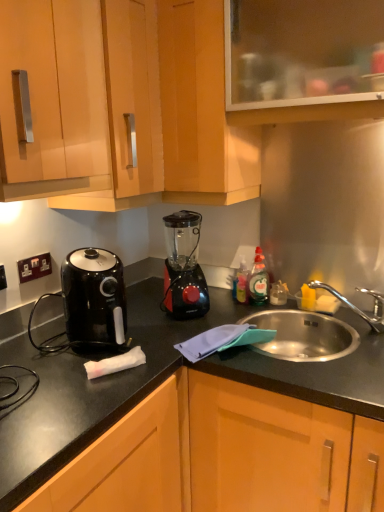
Consider the image. How much space does black plastic electric outlet at lower left, which ranks as the 1th electric outlet in left-to-right order, occupy horizontally?

black plastic electric outlet at lower left, which ranks as the 1th electric outlet in left-to-right order, is 0.73 inches wide.

Based on the photo, in order to face black glossy air fryer at left, should I rotate leftwards or rightwards?

Turn left approximately 11.627 degrees to face it.

Find the location of a particular element. This screenshot has height=512, width=384. black plastic electrical outlet at left, which ranks as the 2th electric outlet in front-to-back order is located at coordinates (34, 267).

What do you see at coordinates (74, 100) in the screenshot?
I see `matte wood cabinet at upper left, which is the second cabinetry from bottom to top` at bounding box center [74, 100].

This screenshot has width=384, height=512. What do you see at coordinates (201, 110) in the screenshot?
I see `wooden cabinet at upper center, which is the 4th cabinetry from bottom to top` at bounding box center [201, 110].

What are the coordinates of `black plastic electric outlet at lower left, positioned as the first electric outlet in front-to-back order` in the screenshot? It's located at (2, 278).

Can you tell me how much black plastic electrical outlet at left, the second electric outlet positioned from the left, and matte wood cabinets at upper center, the third cabinetry from the top, differ in facing direction?

90.1 degrees.

Does black plastic electrical outlet at left, the second electric outlet positioned from the left, turn towards matte wood cabinets at upper center, the third cabinetry from the top?

No, black plastic electrical outlet at left, the second electric outlet positioned from the left, does not turn towards matte wood cabinets at upper center, the third cabinetry from the top.

What are the coordinates of `the 5th cabinetry in front of the black plastic electrical outlet at left, arranged as the first electric outlet when viewed from the back` in the screenshot? It's located at click(137, 108).

Which is closer, (153, 26) or (34, 263)?

Clearly, point (153, 26) is closer to the camera than point (34, 263).

Is matte wood cabinet at upper left, the fourth cabinetry when ordered from top to bottom, positioned far away from black plastic electrical outlet at left, the first electric outlet viewed from the right?

No, matte wood cabinet at upper left, the fourth cabinetry when ordered from top to bottom, is not far from black plastic electrical outlet at left, the first electric outlet viewed from the right.

Is matte wood cabinet at upper left, the fourth cabinetry when ordered from top to bottom, wider than black plastic electrical outlet at left, which ranks as the 2th electric outlet in front-to-back order?

Yes.

Between black plastic electric outlet at lower left, which is counted as the second electric outlet, starting from the back, and black plastic blender at center, which one has smaller width?

With smaller width is black plastic electric outlet at lower left, which is counted as the second electric outlet, starting from the back.

From the image's perspective, is black plastic electric outlet at lower left, which is counted as the second electric outlet, starting from the back, above or below black plastic blender at center?

Based on their image positions, black plastic electric outlet at lower left, which is counted as the second electric outlet, starting from the back, is located beneath black plastic blender at center.

Between point (1, 280) and point (173, 231), which one is positioned behind?

The point (173, 231) is farther from the camera.

From a real-world perspective, is wooden cabinet at upper center, arranged as the second cabinetry when viewed from the top, located beneath black plastic electrical outlet at left, the second electric outlet positioned from the left?

No.

How many degrees apart are the facing directions of wooden cabinet at upper center, which is the 4th cabinetry from bottom to top, and black plastic electrical outlet at left, the second electric outlet positioned from the left?

The facing directions of wooden cabinet at upper center, which is the 4th cabinetry from bottom to top, and black plastic electrical outlet at left, the second electric outlet positioned from the left, are 90.1 degrees apart.

From the image's perspective, which is above, wooden cabinet at upper center, arranged as the second cabinetry when viewed from the top, or black plastic electrical outlet at left, the second electric outlet positioned from the left?

wooden cabinet at upper center, arranged as the second cabinetry when viewed from the top.

Considering the positions of points (192, 117) and (33, 259), is point (192, 117) closer to camera compared to point (33, 259)?

Yes, it is.

Can you tell me how much transparent glass cabinet at upper center, placed as the 1th cabinetry when sorted from top to bottom, and wooden cabinet at upper center, arranged as the second cabinetry when viewed from the top, differ in facing direction?

0.488 degrees.

Can you confirm if transparent glass cabinet at upper center, marked as the fifth cabinetry in a bottom-to-top arrangement, is thinner than wooden cabinet at upper center, which is the 4th cabinetry from bottom to top?

No.

Is transparent glass cabinet at upper center, placed as the 1th cabinetry when sorted from top to bottom, touching wooden cabinet at upper center, which is the 4th cabinetry from bottom to top?

No, transparent glass cabinet at upper center, placed as the 1th cabinetry when sorted from top to bottom, is not touching wooden cabinet at upper center, which is the 4th cabinetry from bottom to top.

In the scene shown: In terms of height, does transparent glass cabinet at upper center, placed as the 1th cabinetry when sorted from top to bottom, look taller or shorter compared to wooden cabinet at upper center, which is the 4th cabinetry from bottom to top?

transparent glass cabinet at upper center, placed as the 1th cabinetry when sorted from top to bottom, is shorter than wooden cabinet at upper center, which is the 4th cabinetry from bottom to top.

Is wooden cabinet at upper center, arranged as the second cabinetry when viewed from the top, closer to the viewer compared to transparent glass cabinet at upper center, placed as the 1th cabinetry when sorted from top to bottom?

No, wooden cabinet at upper center, arranged as the second cabinetry when viewed from the top, is further to the viewer.

Is wooden cabinet at upper center, which is the 4th cabinetry from bottom to top, located outside transparent glass cabinet at upper center, placed as the 1th cabinetry when sorted from top to bottom?

Yes, wooden cabinet at upper center, which is the 4th cabinetry from bottom to top, is outside of transparent glass cabinet at upper center, placed as the 1th cabinetry when sorted from top to bottom.

Looking at the image, does wooden cabinet at upper center, arranged as the second cabinetry when viewed from the top, seem bigger or smaller compared to transparent glass cabinet at upper center, marked as the fifth cabinetry in a bottom-to-top arrangement?

In the image, wooden cabinet at upper center, arranged as the second cabinetry when viewed from the top, appears to be larger than transparent glass cabinet at upper center, marked as the fifth cabinetry in a bottom-to-top arrangement.

From a real-world perspective, which object rests below the other?

wooden cabinet at upper center, arranged as the second cabinetry when viewed from the top, from a real-world perspective.

Does matte wood cabinets at upper center, the third cabinetry from the top, touch transparent glass cabinet at upper center, placed as the 1th cabinetry when sorted from top to bottom?

No, matte wood cabinets at upper center, the third cabinetry from the top, is not beside transparent glass cabinet at upper center, placed as the 1th cabinetry when sorted from top to bottom.

Is matte wood cabinets at upper center, which appears as the 3th cabinetry when ordered from the bottom, facing away from transparent glass cabinet at upper center, marked as the fifth cabinetry in a bottom-to-top arrangement?

matte wood cabinets at upper center, which appears as the 3th cabinetry when ordered from the bottom, does not have its back to transparent glass cabinet at upper center, marked as the fifth cabinetry in a bottom-to-top arrangement.

Does matte wood cabinets at upper center, which appears as the 3th cabinetry when ordered from the bottom, have a lesser width compared to transparent glass cabinet at upper center, placed as the 1th cabinetry when sorted from top to bottom?

No.

This screenshot has height=512, width=384. There is a transparent glass cabinet at upper center, placed as the 1th cabinetry when sorted from top to bottom. In order to click on the 2nd cabinetry below it (from a real-world perspective) in this screenshot , I will do `click(137, 108)`.

Identify the location of the 2nd cabinetry positioned above the black plastic electrical outlet at left, arranged as the first electric outlet when viewed from the back (from a real-world perspective). (137, 108).

Where is `the 2nd cabinetry in front when counting from the black plastic electrical outlet at left, which ranks as the 2th electric outlet in front-to-back order`? the 2nd cabinetry in front when counting from the black plastic electrical outlet at left, which ranks as the 2th electric outlet in front-to-back order is located at coordinates (74, 100).

Which object lies further to the anchor point black plastic electric outlet at lower left, positioned as the first electric outlet in front-to-back order, transparent glass cabinet at upper center, placed as the 1th cabinetry when sorted from top to bottom, or matte wood cabinets at upper center, which appears as the 3th cabinetry when ordered from the bottom?

transparent glass cabinet at upper center, placed as the 1th cabinetry when sorted from top to bottom, is further to black plastic electric outlet at lower left, positioned as the first electric outlet in front-to-back order.

Looking at the image, which one is located further to black glossy air fryer at left, black plastic electric outlet at lower left, which ranks as the 1th electric outlet in left-to-right order, or wooden cabinet at lower center, which appears as the 5th cabinetry when viewed from the top?

wooden cabinet at lower center, which appears as the 5th cabinetry when viewed from the top, is further to black glossy air fryer at left.

Which object lies further to the anchor point black plastic electrical outlet at left, the second electric outlet positioned from the left, black glossy air fryer at left or wooden cabinet at upper center, which is the 4th cabinetry from bottom to top?

The object further to black plastic electrical outlet at left, the second electric outlet positioned from the left, is wooden cabinet at upper center, which is the 4th cabinetry from bottom to top.

When comparing their distances from matte wood cabinets at upper center, the third cabinetry from the top, does black plastic electric outlet at lower left, which ranks as the 1th electric outlet in left-to-right order, or wooden cabinet at upper center, which is the 4th cabinetry from bottom to top, seem further?

black plastic electric outlet at lower left, which ranks as the 1th electric outlet in left-to-right order.

When comparing their distances from wooden cabinet at lower center, which appears as the 5th cabinetry when viewed from the top, does matte wood cabinets at upper center, which appears as the 3th cabinetry when ordered from the bottom, or matte wood cabinet at upper left, which is the second cabinetry from bottom to top, seem closer?

matte wood cabinets at upper center, which appears as the 3th cabinetry when ordered from the bottom, lies closer to wooden cabinet at lower center, which appears as the 5th cabinetry when viewed from the top, than the other object.

When comparing their distances from transparent glass cabinet at upper center, placed as the 1th cabinetry when sorted from top to bottom, does matte wood cabinets at upper center, the third cabinetry from the top, or wooden cabinet at upper center, arranged as the second cabinetry when viewed from the top, seem closer?

wooden cabinet at upper center, arranged as the second cabinetry when viewed from the top, lies closer to transparent glass cabinet at upper center, placed as the 1th cabinetry when sorted from top to bottom, than the other object.

Considering their positions, is wooden cabinet at upper center, which is the 4th cabinetry from bottom to top, positioned further to wooden cabinet at lower center, which appears as the 1th cabinetry when ordered from the bottom, than matte wood cabinet at upper left, the fourth cabinetry when ordered from top to bottom?

The object further to wooden cabinet at lower center, which appears as the 1th cabinetry when ordered from the bottom, is matte wood cabinet at upper left, the fourth cabinetry when ordered from top to bottom.

Looking at the image, which one is located closer to black glossy air fryer at left, matte wood cabinet at upper left, which is the second cabinetry from bottom to top, or black plastic blender at center?

Based on the image, black plastic blender at center appears to be nearer to black glossy air fryer at left.

At what (x,y) coordinates should I click in order to perform the action: click on electric outlet between black plastic electric outlet at lower left, which is counted as the 2th electric outlet, starting from the right, and wooden cabinet at lower center, which appears as the 5th cabinetry when viewed from the top, in the horizontal direction. Please return your answer as a coordinate pair (x, y). Looking at the image, I should click on point(34,267).

I want to click on kitchen appliance between black plastic electric outlet at lower left, which ranks as the 1th electric outlet in left-to-right order, and wooden cabinet at lower center, which appears as the 5th cabinetry when viewed from the top, so click(x=184, y=267).

The height and width of the screenshot is (512, 384). What are the coordinates of `kitchen appliance that lies between matte wood cabinet at upper left, the fourth cabinetry when ordered from top to bottom, and black plastic electric outlet at lower left, which is counted as the 2th electric outlet, starting from the right, from top to bottom` in the screenshot? It's located at (184, 267).

This screenshot has width=384, height=512. Identify the location of cabinetry between matte wood cabinets at upper center, the third cabinetry from the top, and black glossy air fryer at left, in the vertical direction. (74, 100).